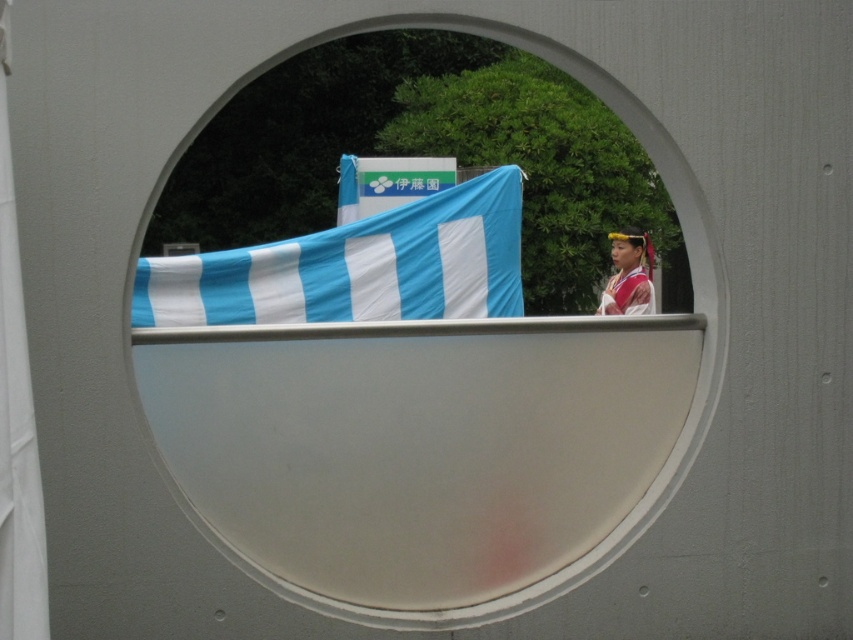
Consider the image. You are an architect designing a new building and want to place a circular window in the same location as the white matte oval at center in the image. The building wall has a coordinate system where the bottom left corner is the origin. What are the coordinates of the center of the circular window you should design?

The coordinates of the center of the white matte oval at center are at point (444, 433), so the architect should design the circular window with its center at those coordinates.